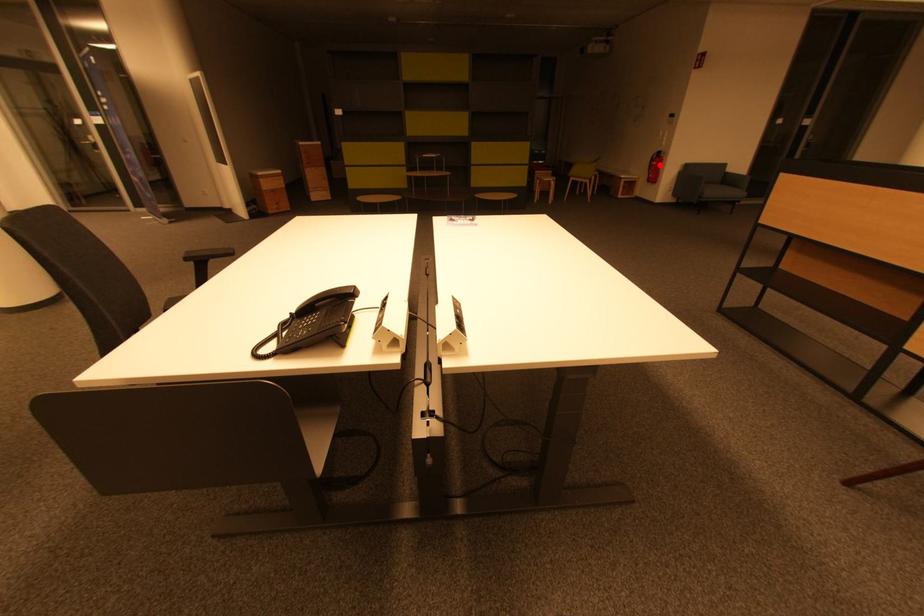
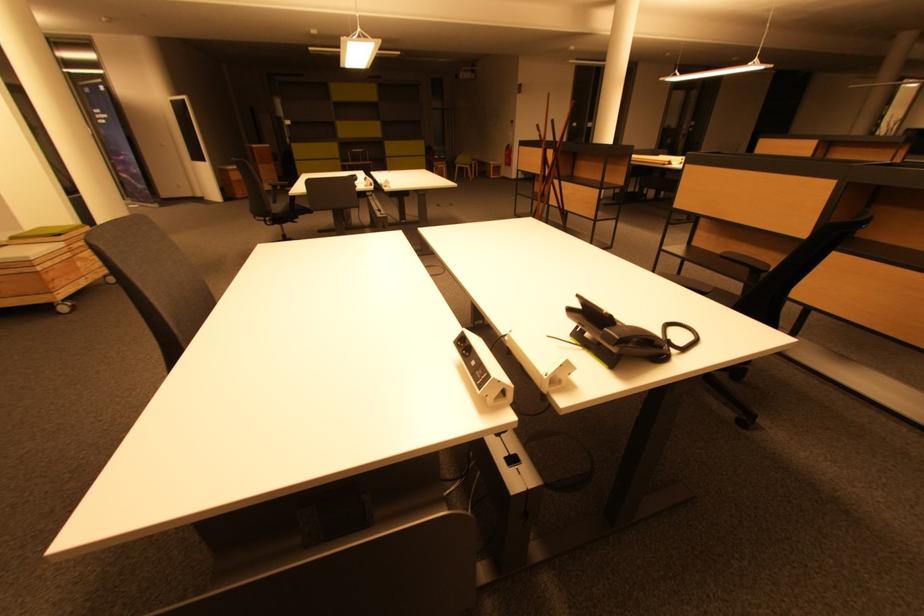
In the second image, find the point that corresponds to the highlighted location in the first image.

(512, 155)